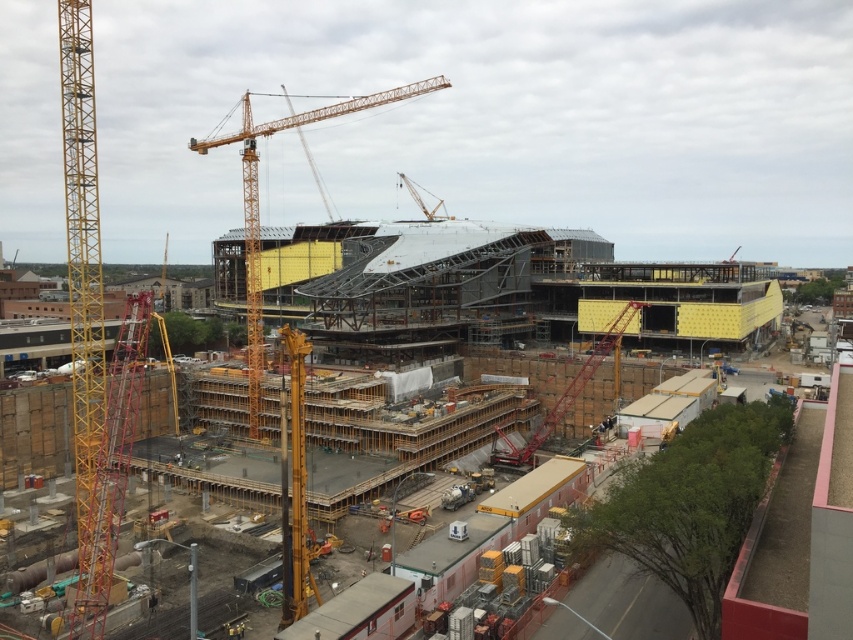
Is point (347, 442) positioned behind point (422, 92)?

That is False.

Which is below, yellow wood construction site at center or yellow metallic crane at upper left?

yellow wood construction site at center

Measure the distance between point (496, 248) and camera.

They are 157.59 meters apart.

I want to click on yellow wood construction site at center, so click(518, 280).

Can you confirm if yellow wood construction site at center is wider than yellow metallic crane at left?

Yes, yellow wood construction site at center is wider than yellow metallic crane at left.

Who is shorter, yellow wood construction site at center or yellow metallic crane at left?

With less height is yellow metallic crane at left.

I want to click on yellow wood construction site at center, so click(518, 280).

Is yellow metallic crane at left smaller than yellow metallic crane at upper left?

Yes.

Is point (90, 621) positioned behind point (242, 97)?

No, it is not.

The height and width of the screenshot is (640, 853). I want to click on yellow metallic crane at left, so click(112, 467).